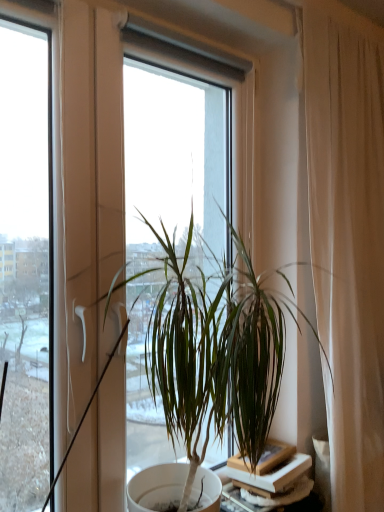
Question: Considering the positions of point (x=286, y=506) and point (x=251, y=416), is point (x=286, y=506) closer or farther from the camera than point (x=251, y=416)?

Choices:
 (A) closer
 (B) farther

Answer: (B)

Question: Is white matte table at lower right in front of or behind green leafy plant at center in the image?

Choices:
 (A) front
 (B) behind

Answer: (B)

Question: From a real-world perspective, relative to green leafy plant at center, is white matte table at lower right vertically above or below?

Choices:
 (A) below
 (B) above

Answer: (A)

Question: From a real-world perspective, is green leafy plant at center positioned above or below white matte table at lower right?

Choices:
 (A) below
 (B) above

Answer: (B)

Question: Is green leafy plant at center to the left or to the right of white matte table at lower right in the image?

Choices:
 (A) right
 (B) left

Answer: (B)

Question: In terms of height, does green leafy plant at center look taller or shorter compared to white matte table at lower right?

Choices:
 (A) short
 (B) tall

Answer: (B)

Question: Looking at the image, does green leafy plant at center seem bigger or smaller compared to white matte table at lower right?

Choices:
 (A) small
 (B) big

Answer: (B)